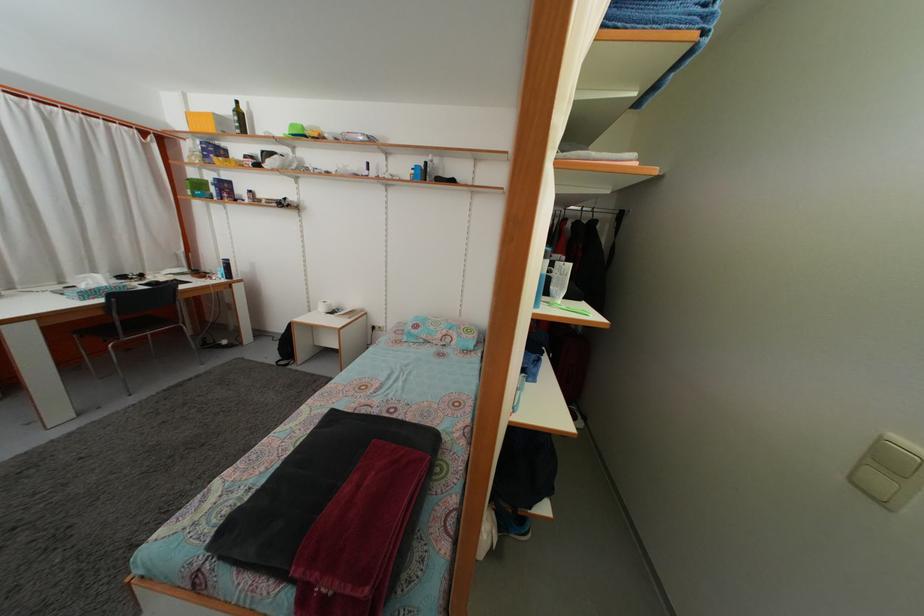
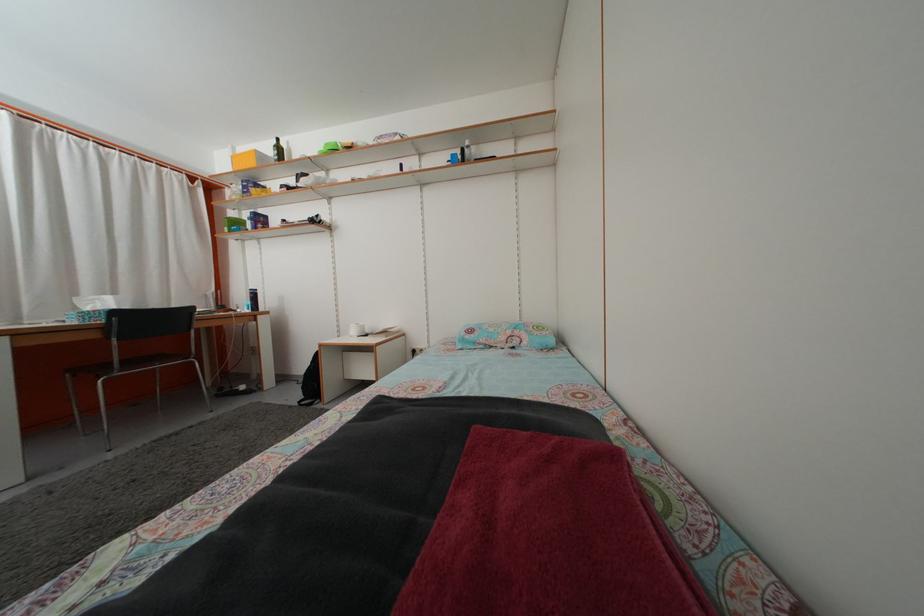
Find the pixel in the second image that matches pixel 445 344 in the first image.

(508, 346)